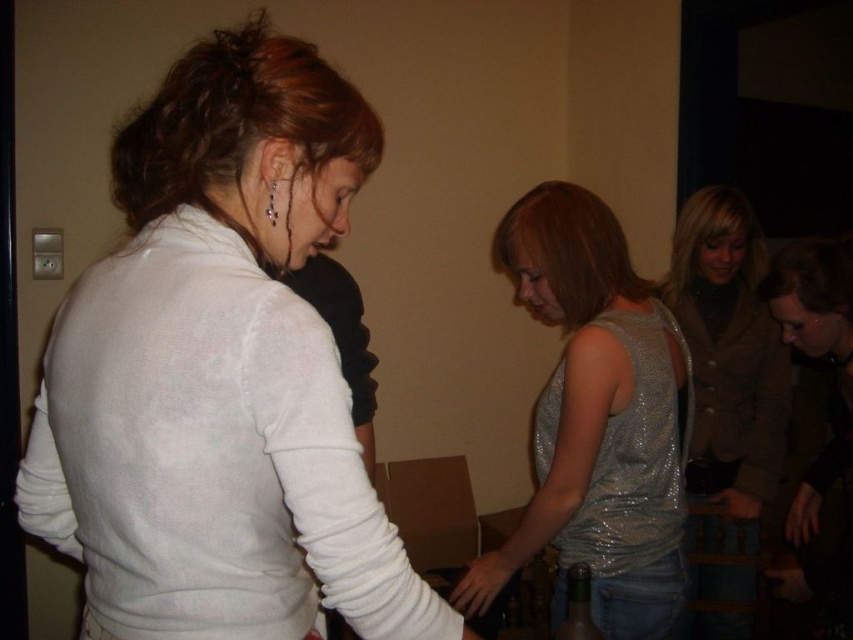
You are standing in the room and want to find the white matte sweater at upper left. Based on the coordinates provided, where would you look relative to the center of the image?

The white matte sweater at upper left is located at coordinates point (219,372), which is to the upper left of the center of the image.

You are a photographer trying to capture a closeup of the smooth skin hand at center and the matte black hand at lower right. Which hand will appear larger in the photo?

The smooth skin hand at center will appear larger in the photo because it is closer to the viewer than the matte black hand at lower right.

You are a photographer at this event and want to capture both the smooth skin hand at center and the matte black hand at lower right in the same frame. Given their sizes, which hand should you focus on to ensure both are clearly visible?

The smooth skin hand at center is larger than the matte black hand at lower right, so focusing on the smooth skin hand at center would help ensure both are clearly visible in the frame.